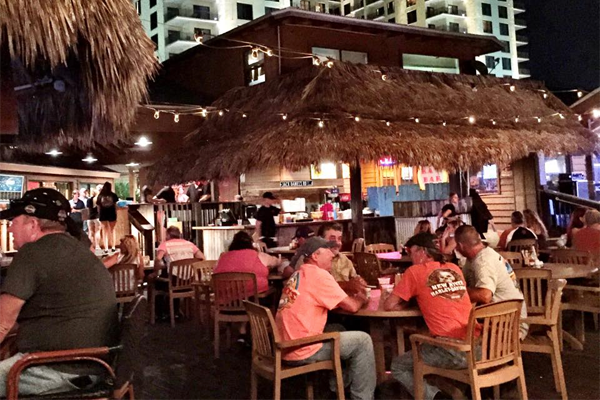
Locate an element on the screen. The width and height of the screenshot is (600, 400). dark hardwood flooring is located at coordinates pyautogui.click(x=175, y=380), pyautogui.click(x=579, y=370).